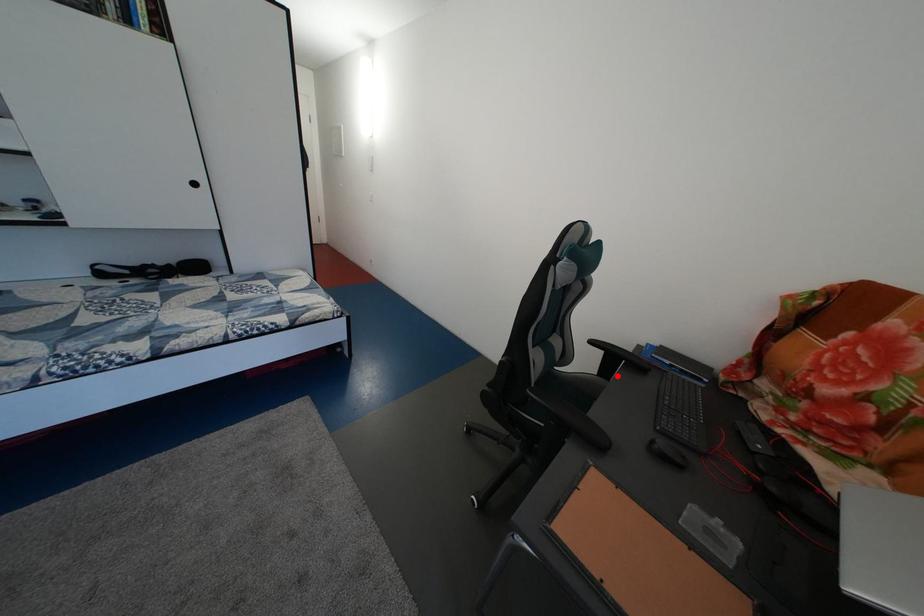
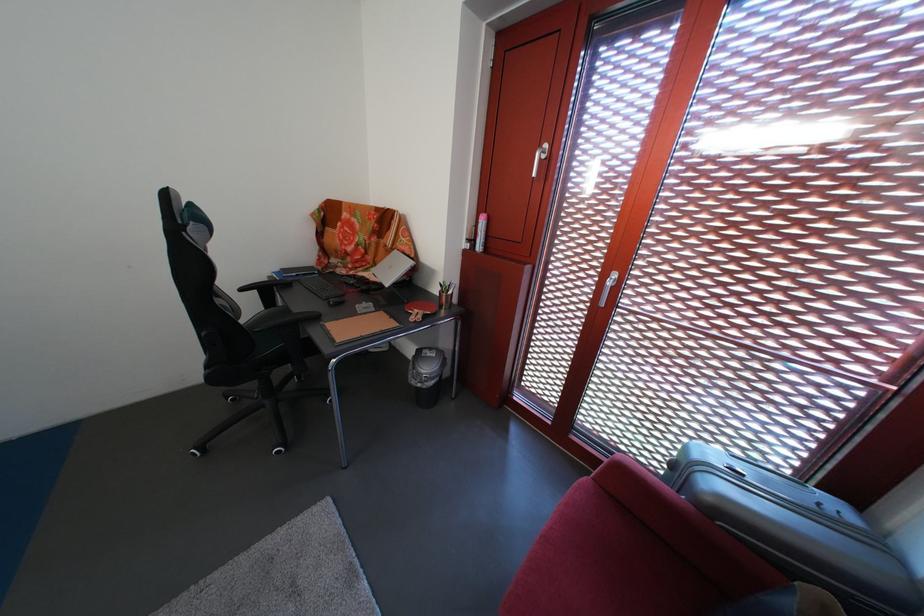
Question: I am providing you with two images of the same scene from different viewpoints. Image1 has a red point marked. In image2, the corresponding 3D location appears at what relative position? Reply with the corresponding letter.

Choices:
 (A) Closer
 (B) Farther

Answer: (B)